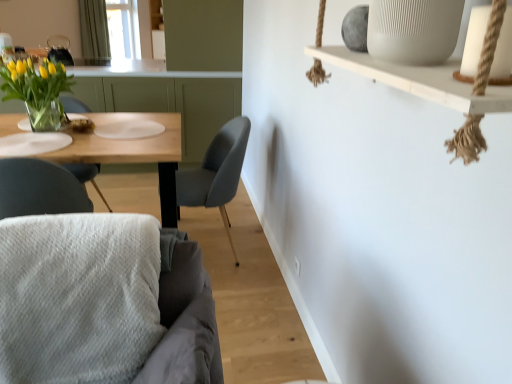
Question: Is translucent glass vase with yellow tulips at left at the back of white textured cushion at lower left, arranged as the second chair when viewed from the back?

Choices:
 (A) yes
 (B) no

Answer: (A)

Question: Considering the relative sizes of white textured cushion at lower left, arranged as the second chair when viewed from the back, and translucent glass vase with yellow tulips at left in the image provided, is white textured cushion at lower left, arranged as the second chair when viewed from the back, smaller than translucent glass vase with yellow tulips at left?

Choices:
 (A) yes
 (B) no

Answer: (B)

Question: Is white textured cushion at lower left, which is the first chair in front-to-back order, not within translucent glass vase with yellow tulips at left?

Choices:
 (A) yes
 (B) no

Answer: (A)

Question: Considering the relative sizes of white textured cushion at lower left, arranged as the second chair when viewed from the back, and translucent glass vase with yellow tulips at left in the image provided, is white textured cushion at lower left, arranged as the second chair when viewed from the back, taller than translucent glass vase with yellow tulips at left?

Choices:
 (A) no
 (B) yes

Answer: (B)

Question: Does white textured cushion at lower left, which is the first chair in front-to-back order, come in front of translucent glass vase with yellow tulips at left?

Choices:
 (A) yes
 (B) no

Answer: (A)

Question: Does white textured cushion at lower left, which is the first chair in front-to-back order, touch translucent glass vase with yellow tulips at left?

Choices:
 (A) no
 (B) yes

Answer: (A)

Question: Is wooden table at left closer to camera compared to transparent glass window screen at upper center?

Choices:
 (A) no
 (B) yes

Answer: (B)

Question: Can we say wooden table at left lies outside transparent glass window screen at upper center?

Choices:
 (A) yes
 (B) no

Answer: (A)

Question: Is wooden table at left positioned far away from transparent glass window screen at upper center?

Choices:
 (A) yes
 (B) no

Answer: (A)

Question: Is wooden table at left surrounding transparent glass window screen at upper center?

Choices:
 (A) yes
 (B) no

Answer: (B)

Question: Is wooden table at left to the left of transparent glass window screen at upper center from the viewer's perspective?

Choices:
 (A) no
 (B) yes

Answer: (A)

Question: Can you confirm if wooden table at left is positioned to the right of transparent glass window screen at upper center?

Choices:
 (A) no
 (B) yes

Answer: (B)

Question: Considering the relative sizes of green fabric curtain at upper left and translucent glass vase with yellow tulips at left in the image provided, is green fabric curtain at upper left smaller than translucent glass vase with yellow tulips at left?

Choices:
 (A) yes
 (B) no

Answer: (B)